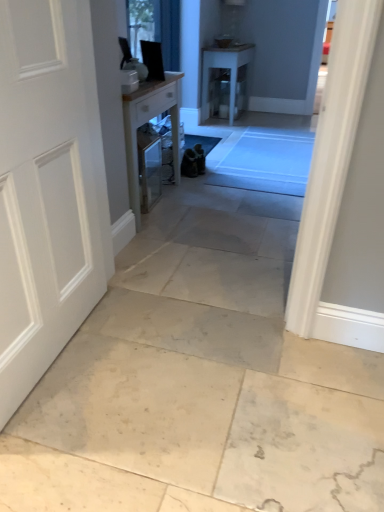
At what (x,y) coordinates should I click in order to perform the action: click on vacant area located to the right-hand side of white matte door at left. Please return your answer as a coordinate pair (x, y). Looking at the image, I should click on (158, 371).